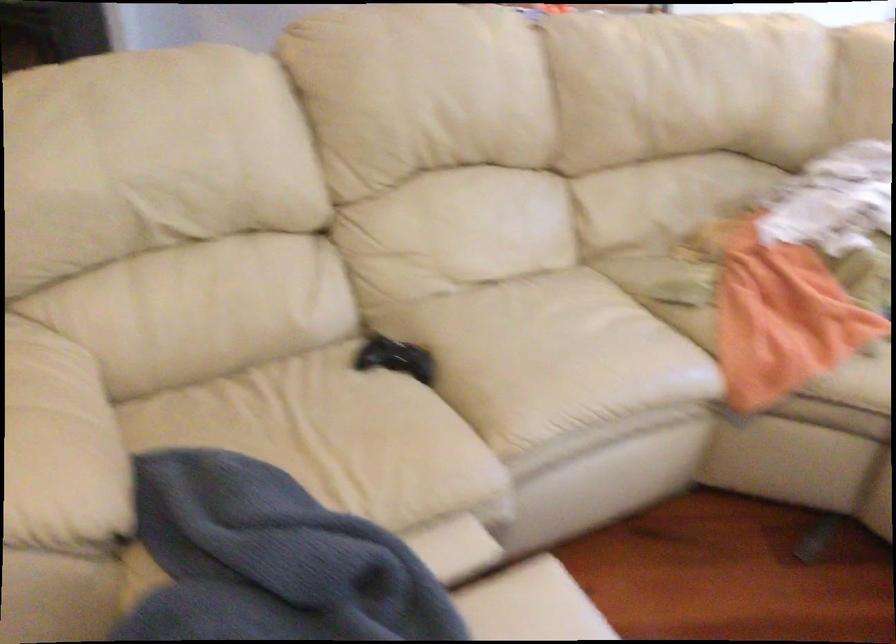
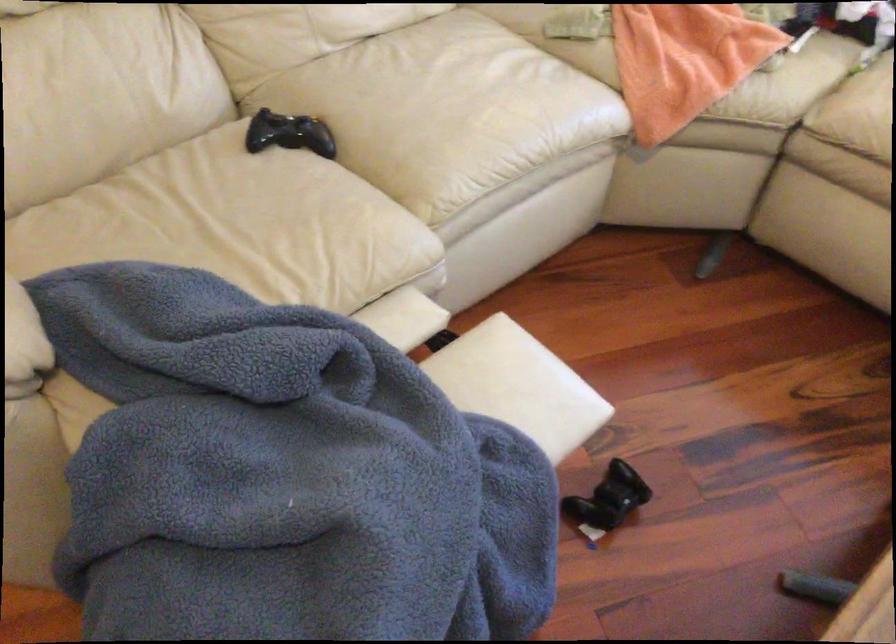
The point at (323, 431) is marked in the first image. Where is the corresponding point in the second image?

(237, 225)